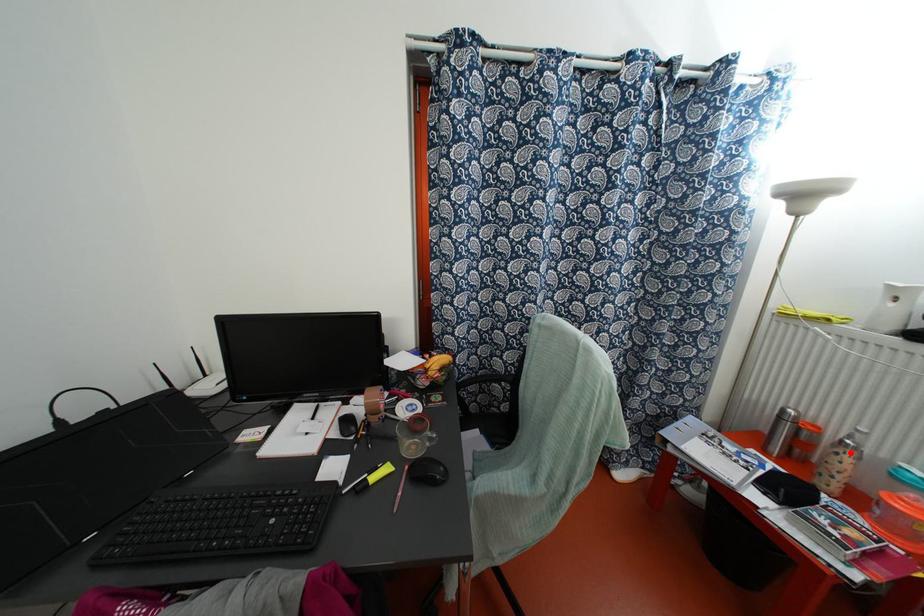
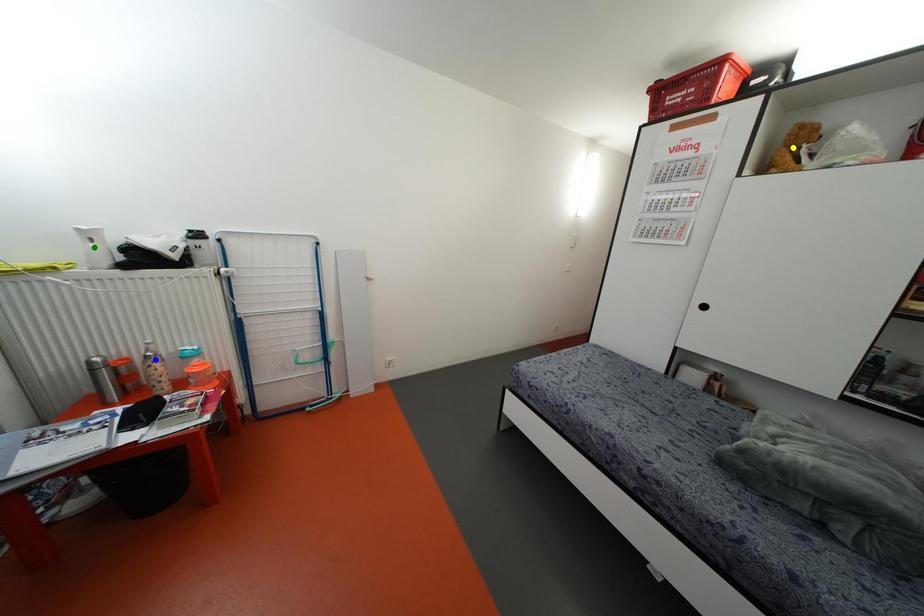
Question: I am providing you with two images of the same scene from different viewpoints. A red point is marked on the first image. You are given multiple points on the second image. In image 2, which mark is for the same physical point as the one in image 1?

Choices:
 (A) yellow point
 (B) blue point
 (C) green point

Answer: (B)